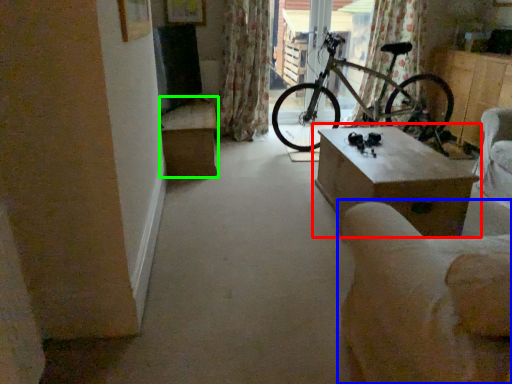
Question: Which object is positioned closest to table (highlighted by a red box)? Select from armchair (highlighted by a blue box) and table (highlighted by a green box).

Choices:
 (A) armchair
 (B) table

Answer: (A)